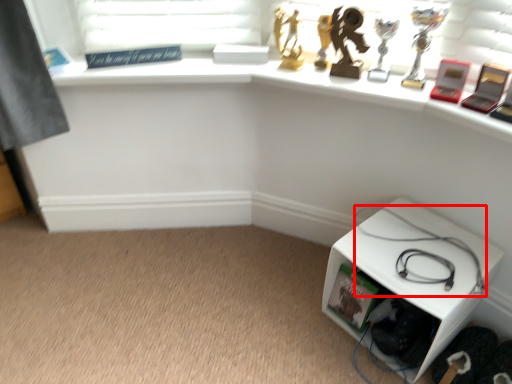
Question: From the image, what is the correct spatial relationship of cable (annotated by the red box) in relation to furniture?

Choices:
 (A) right
 (B) left

Answer: (B)